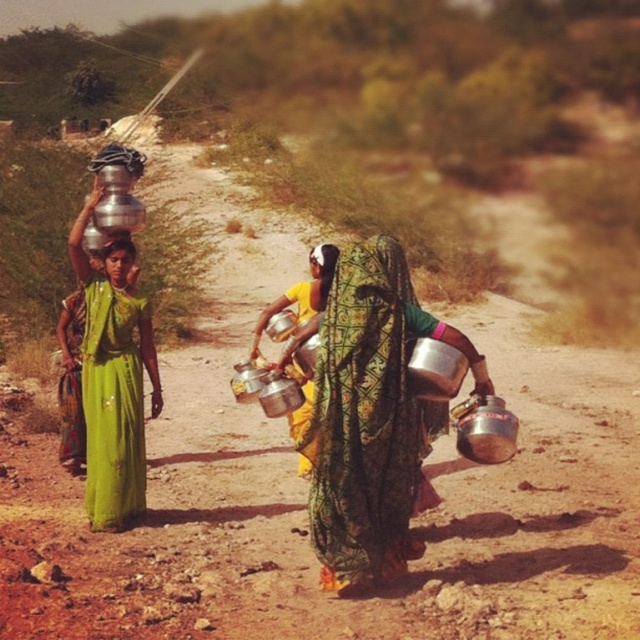
Consider the image. Who is positioned more to the right, shiny metallic pot at center or matte green dress at center?

Positioned to the right is shiny metallic pot at center.

From the picture: Who is shorter, shiny metallic pot at center or matte green dress at center?

matte green dress at center is shorter.

Does point (397, 356) lie in front of point (113, 237)?

Yes, point (397, 356) is in front of point (113, 237).

Locate an element on the screen. Image resolution: width=640 pixels, height=640 pixels. shiny metallic pot at center is located at coordinates (371, 417).

Between matte green dress at center and matte black hair at center, which one has more height?

matte black hair at center is taller.

Describe the element at coordinates (120, 260) in the screenshot. This screenshot has width=640, height=640. I see `matte green dress at center` at that location.

At what (x,y) coordinates should I click in order to perform the action: click on matte green dress at center. Please return your answer as a coordinate pair (x, y). The height and width of the screenshot is (640, 640). Looking at the image, I should click on (120, 260).

Can you confirm if shiny metallic pot at center is positioned above matte silver water at left?

No, shiny metallic pot at center is not above matte silver water at left.

Is point (365, 512) more distant than point (90, 205)?

No, (365, 512) is in front of (90, 205).

You are a GUI agent. You are given a task and a screenshot of the screen. Output one action in this format:
    pyautogui.click(x=<x>, y=<y>)
    Task: Click on the shiny metallic pot at center
    The height and width of the screenshot is (640, 640).
    Given the screenshot: What is the action you would take?
    pyautogui.click(x=371, y=417)